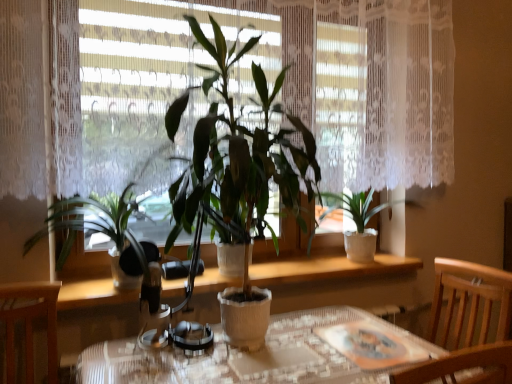
Question: Considering the positions of point (246, 271) and point (179, 374), is point (246, 271) closer or farther from the camera than point (179, 374)?

Choices:
 (A) closer
 (B) farther

Answer: (B)

Question: From a real-world perspective, is green matte plant at center, which is the 2th houseplant in left-to-right order, above or below textured glass table at center?

Choices:
 (A) above
 (B) below

Answer: (A)

Question: Estimate the real-world distances between objects in this image. Which object is farther from the metallic silver headphones at center?

Choices:
 (A) wooden chair at lower right
 (B) white textured pot at center, arranged as the 3th houseplant when viewed from the left
 (C) textured glass table at center
 (D) white textured window sill at center
 (E) green matte plant at center, which is the 2th houseplant in right-to-left order

Answer: (A)

Question: Which object is positioned farthest from the green matte plant at center, which appears as the third houseplant when viewed from the right?

Choices:
 (A) green matte plant at center, which is the 2th houseplant in right-to-left order
 (B) wooden chair at lower right
 (C) white textured window sill at center
 (D) metallic silver headphones at center
 (E) textured glass table at center

Answer: (B)